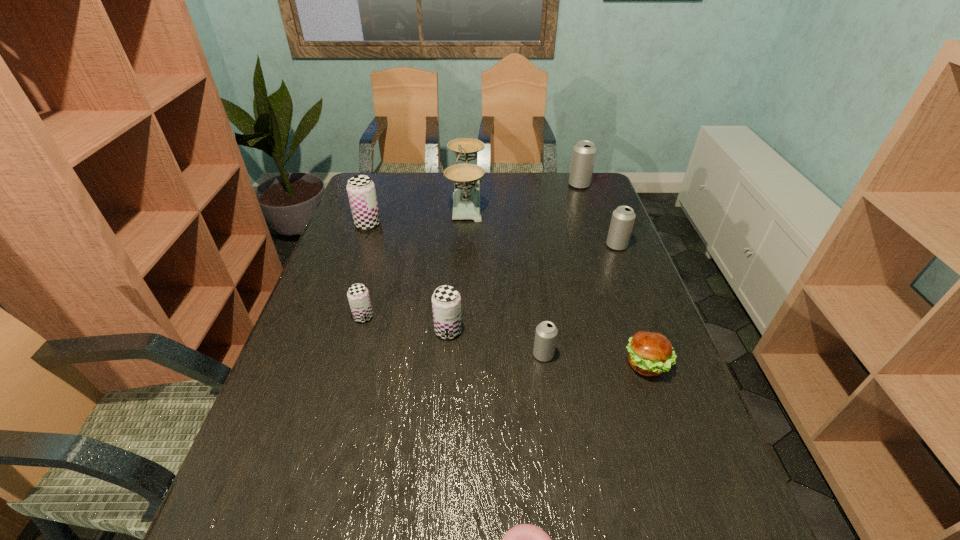
The height and width of the screenshot is (540, 960). In order to click on free space at the far right corner of the desktop in this screenshot , I will do `click(561, 172)`.

The width and height of the screenshot is (960, 540). Find the location of `free space between the scale and the fourth nearest beer can`. free space between the scale and the fourth nearest beer can is located at coordinates (541, 221).

At what (x,y) coordinates should I click in order to perform the action: click on free space between the third beer can from right to left and the second shortest object. Please return your answer as a coordinate pair (x, y). Looking at the image, I should click on pos(595,360).

Where is `empty space that is in between the scale and the biggest white beer can`? The width and height of the screenshot is (960, 540). empty space that is in between the scale and the biggest white beer can is located at coordinates (522, 191).

Where is `vacant region between the second nearest white beer can and the scale`? The height and width of the screenshot is (540, 960). vacant region between the second nearest white beer can and the scale is located at coordinates (541, 221).

The image size is (960, 540). What are the coordinates of `blank region between the second smallest white beer can and the second shortest object` in the screenshot? It's located at (632, 305).

Where is `object identified as the second closest to the farthest white beer can`? object identified as the second closest to the farthest white beer can is located at coordinates (466, 177).

You are a GUI agent. You are given a task and a screenshot of the screen. Output one action in this format:
    pyautogui.click(x=<x>, y=<y>)
    Task: Click on the second closest object relative to the fourth beer can from left to right
    Image resolution: width=960 pixels, height=540 pixels.
    Given the screenshot: What is the action you would take?
    pyautogui.click(x=446, y=301)

At what (x,y) coordinates should I click in order to perform the action: click on the second closest beer can to the shortest object. Please return your answer as a coordinate pair (x, y). Looking at the image, I should click on (446, 301).

Select which beer can appears as the sixth closest to the pink doughnut. Please provide its 2D coordinates. Your answer should be formatted as a tuple, i.e. [(x, y)], where the tuple contains the x and y coordinates of a point satisfying the conditions above.

[(584, 152)]